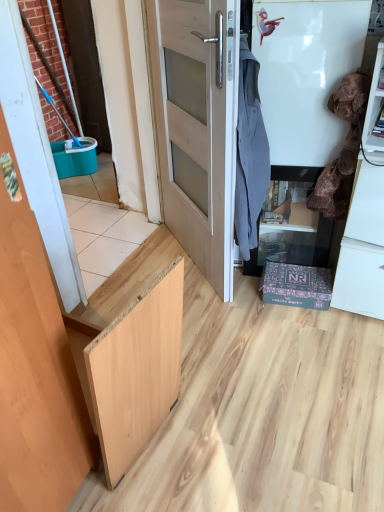
Question: From a real-world perspective, is gray fabric shirt at upper right, the second laundry in the right-to-left sequence, under velvet brown laundry at right, marked as the 2th laundry in a left-to-right arrangement?

Choices:
 (A) no
 (B) yes

Answer: (B)

Question: Considering the relative sizes of gray fabric shirt at upper right, the second laundry in the right-to-left sequence, and velvet brown laundry at right, acting as the first laundry starting from the right, in the image provided, is gray fabric shirt at upper right, the second laundry in the right-to-left sequence, wider than velvet brown laundry at right, acting as the first laundry starting from the right,?

Choices:
 (A) yes
 (B) no

Answer: (A)

Question: From a real-world perspective, is gray fabric shirt at upper right, the second laundry in the right-to-left sequence, over velvet brown laundry at right, acting as the first laundry starting from the right?

Choices:
 (A) yes
 (B) no

Answer: (B)

Question: Is gray fabric shirt at upper right, acting as the 1th laundry starting from the left, oriented away from velvet brown laundry at right, marked as the 2th laundry in a left-to-right arrangement?

Choices:
 (A) yes
 (B) no

Answer: (B)

Question: Considering the relative sizes of gray fabric shirt at upper right, acting as the 1th laundry starting from the left, and velvet brown laundry at right, acting as the first laundry starting from the right, in the image provided, is gray fabric shirt at upper right, acting as the 1th laundry starting from the left, taller than velvet brown laundry at right, acting as the first laundry starting from the right,?

Choices:
 (A) no
 (B) yes

Answer: (B)

Question: From the image's perspective, is gray fabric shirt at upper right, the second laundry in the right-to-left sequence, below velvet brown laundry at right, marked as the 2th laundry in a left-to-right arrangement?

Choices:
 (A) no
 (B) yes

Answer: (B)

Question: Is matte black cabinet at lower right located within velvet brown laundry at right, marked as the 2th laundry in a left-to-right arrangement?

Choices:
 (A) yes
 (B) no

Answer: (B)

Question: Can you confirm if velvet brown laundry at right, acting as the first laundry starting from the right, is positioned to the left of matte black cabinet at lower right?

Choices:
 (A) no
 (B) yes

Answer: (A)

Question: From a real-world perspective, is velvet brown laundry at right, marked as the 2th laundry in a left-to-right arrangement, physically below matte black cabinet at lower right?

Choices:
 (A) yes
 (B) no

Answer: (B)

Question: Does velvet brown laundry at right, acting as the first laundry starting from the right, have a larger size compared to matte black cabinet at lower right?

Choices:
 (A) no
 (B) yes

Answer: (A)

Question: Is velvet brown laundry at right, marked as the 2th laundry in a left-to-right arrangement, with matte black cabinet at lower right?

Choices:
 (A) yes
 (B) no

Answer: (B)

Question: Considering the relative sizes of velvet brown laundry at right, acting as the first laundry starting from the right, and matte black cabinet at lower right in the image provided, is velvet brown laundry at right, acting as the first laundry starting from the right, smaller than matte black cabinet at lower right?

Choices:
 (A) yes
 (B) no

Answer: (A)

Question: Is wooden door at left, which is counted as the first door, starting from the left, a part of light wood door at center, the 1th door viewed from the right?

Choices:
 (A) yes
 (B) no

Answer: (B)